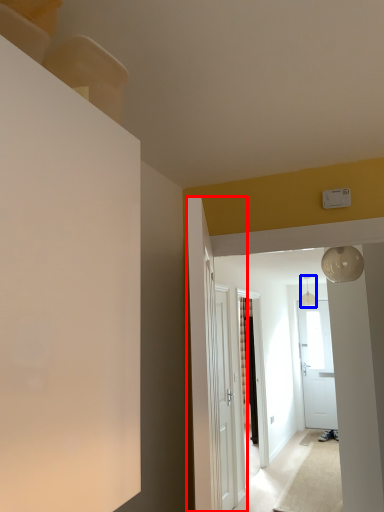
Question: Which object appears farthest to the camera in this image, door (highlighted by a red box) or light fixture (highlighted by a blue box)?

Choices:
 (A) door
 (B) light fixture

Answer: (B)